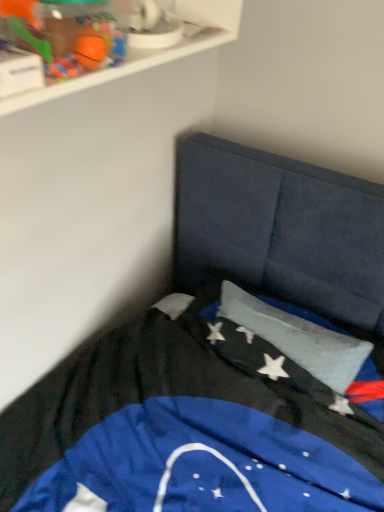
Question: Is rubberized orange ball at upper left looking in the opposite direction of white plastic shelf at upper left?

Choices:
 (A) yes
 (B) no

Answer: (A)

Question: Would you say rubberized orange ball at upper left is outside white plastic shelf at upper left?

Choices:
 (A) yes
 (B) no

Answer: (B)

Question: Considering the relative sizes of rubberized orange ball at upper left and white plastic shelf at upper left in the image provided, is rubberized orange ball at upper left thinner than white plastic shelf at upper left?

Choices:
 (A) yes
 (B) no

Answer: (A)

Question: Does rubberized orange ball at upper left have a smaller size compared to white plastic shelf at upper left?

Choices:
 (A) no
 (B) yes

Answer: (B)

Question: Is the position of rubberized orange ball at upper left more distant than that of white plastic shelf at upper left?

Choices:
 (A) no
 (B) yes

Answer: (B)

Question: From the image's perspective, is rubberized orange ball at upper left positioned above or below silky blue flag at center?

Choices:
 (A) below
 (B) above

Answer: (B)

Question: Visually, is rubberized orange ball at upper left positioned to the left or to the right of silky blue flag at center?

Choices:
 (A) right
 (B) left

Answer: (B)

Question: From a real-world perspective, relative to silky blue flag at center, is rubberized orange ball at upper left vertically above or below?

Choices:
 (A) below
 (B) above

Answer: (B)

Question: From their relative heights in the image, would you say rubberized orange ball at upper left is taller or shorter than silky blue flag at center?

Choices:
 (A) short
 (B) tall

Answer: (A)

Question: In the image, is rubberized orange ball at upper left on the left side or the right side of white plastic shelf at upper left?

Choices:
 (A) left
 (B) right

Answer: (A)

Question: From the image's perspective, relative to white plastic shelf at upper left, is rubberized orange ball at upper left above or below?

Choices:
 (A) above
 (B) below

Answer: (B)

Question: From a real-world perspective, is rubberized orange ball at upper left above or below white plastic shelf at upper left?

Choices:
 (A) below
 (B) above

Answer: (B)

Question: Does point (104, 57) appear closer or farther from the camera than point (152, 62)?

Choices:
 (A) farther
 (B) closer

Answer: (B)

Question: Is point (3, 115) closer or farther from the camera than point (102, 23)?

Choices:
 (A) farther
 (B) closer

Answer: (B)

Question: From the image's perspective, is white plastic shelf at upper left located above or below rubberized orange ball at upper left?

Choices:
 (A) below
 (B) above

Answer: (B)